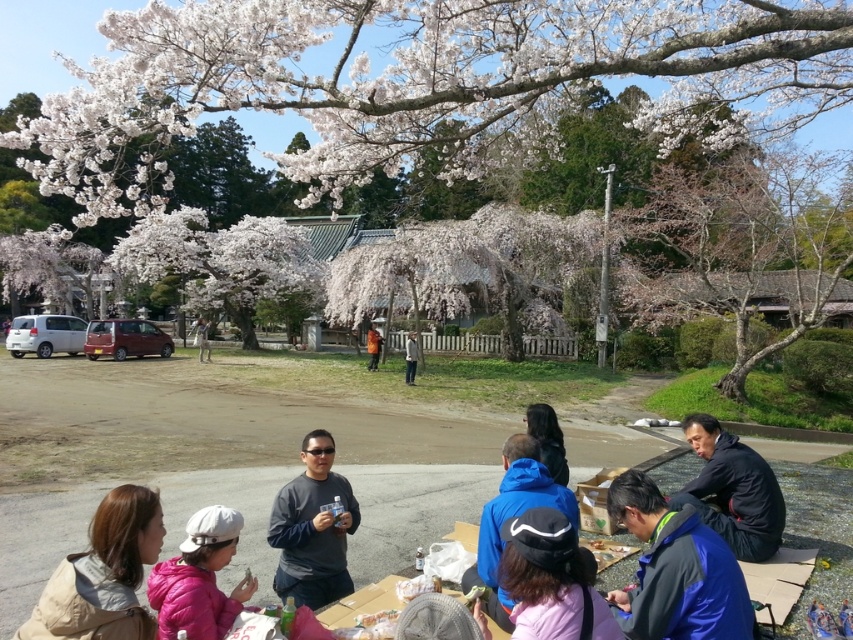
You are standing at the picnic area and want to hand a snack to both the person wearing the blue jacket at lower center and the dark gray jacket at center. Which person should you approach first to give them their snack?

You should approach the blue jacket at lower center first because they are closer to you than the dark gray jacket at center.

You are organizing a group photo for the people at the picnic. You need to arrange them so that everyone can fit in the frame. The photographer mentions that the blue jacket at lower center and the dark gray jacket at center must be visible. Considering their sizes, which jacket should be placed closer to the camera to ensure both are clearly visible?

The blue jacket at lower center is smaller in width than the dark gray jacket at center. To ensure both are clearly visible, the smaller blue jacket at lower center should be placed closer to the camera so that its size appears similar to the larger dark gray jacket at center in the photo.